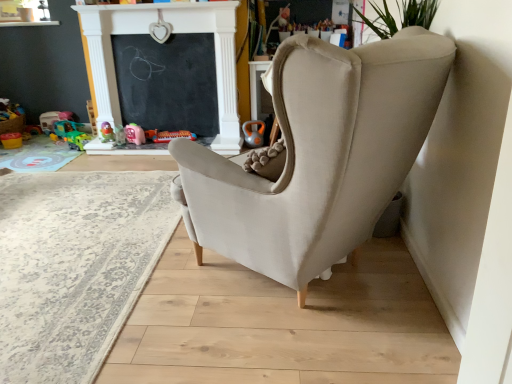
Question: Does matte plastic toy at center, marked as the 4th toy in a left-to-right arrangement, appear on the right side of matte plastic kettlebell at center, arranged as the 7th toy when viewed from the left?

Choices:
 (A) yes
 (B) no

Answer: (B)

Question: Is the position of matte plastic toy at center, marked as the 4th toy in a left-to-right arrangement, more distant than that of matte plastic kettlebell at center, arranged as the 7th toy when viewed from the left?

Choices:
 (A) yes
 (B) no

Answer: (B)

Question: Can you confirm if matte plastic toy at center, marked as the 4th toy in a left-to-right arrangement, is shorter than matte plastic kettlebell at center, placed as the 1th toy when sorted from right to left?

Choices:
 (A) yes
 (B) no

Answer: (A)

Question: Could you tell me if matte plastic toy at center, marked as the 4th toy in a left-to-right arrangement, is facing matte plastic kettlebell at center, arranged as the 7th toy when viewed from the left?

Choices:
 (A) yes
 (B) no

Answer: (B)

Question: Can you confirm if matte plastic toy at center, which appears as the 4th toy when viewed from the right, is taller than matte plastic kettlebell at center, arranged as the 7th toy when viewed from the left?

Choices:
 (A) yes
 (B) no

Answer: (B)

Question: From the image's perspective, is matte pink plastic toy at center, which ranks as the fifth toy in left-to-right order, positioned above or below matte plastic kettlebell at center, placed as the 1th toy when sorted from right to left?

Choices:
 (A) above
 (B) below

Answer: (B)

Question: Relative to matte plastic kettlebell at center, placed as the 1th toy when sorted from right to left, is matte pink plastic toy at center, the third toy in the right-to-left sequence, in front or behind?

Choices:
 (A) front
 (B) behind

Answer: (A)

Question: From a real-world perspective, relative to matte plastic kettlebell at center, placed as the 1th toy when sorted from right to left, is matte pink plastic toy at center, the third toy in the right-to-left sequence, vertically above or below?

Choices:
 (A) above
 (B) below

Answer: (A)

Question: Is point (125, 130) closer or farther from the camera than point (248, 124)?

Choices:
 (A) closer
 (B) farther

Answer: (B)

Question: Considering the positions of point (75, 139) and point (216, 129), is point (75, 139) closer or farther from the camera than point (216, 129)?

Choices:
 (A) farther
 (B) closer

Answer: (A)

Question: Relative to black chalkboard at upper center, is plastic green toy car at center, which is the fifth toy in right-to-left order, in front or behind?

Choices:
 (A) behind
 (B) front

Answer: (A)

Question: Based on their positions, is plastic green toy car at center, which is the fifth toy in right-to-left order, located to the left or right of black chalkboard at upper center?

Choices:
 (A) right
 (B) left

Answer: (B)

Question: From the image's perspective, is plastic green toy car at center, which is the fifth toy in right-to-left order, above or below black chalkboard at upper center?

Choices:
 (A) below
 (B) above

Answer: (A)

Question: Is translucent plastic toy at lower left, the 6th toy when ordered from right to left, bigger or smaller than plastic green toy car at center, which is counted as the 3th toy, starting from the left?

Choices:
 (A) big
 (B) small

Answer: (A)

Question: Would you say translucent plastic toy at lower left, the 6th toy when ordered from right to left, is to the left or to the right of plastic green toy car at center, which is counted as the 3th toy, starting from the left, in the picture?

Choices:
 (A) right
 (B) left

Answer: (B)